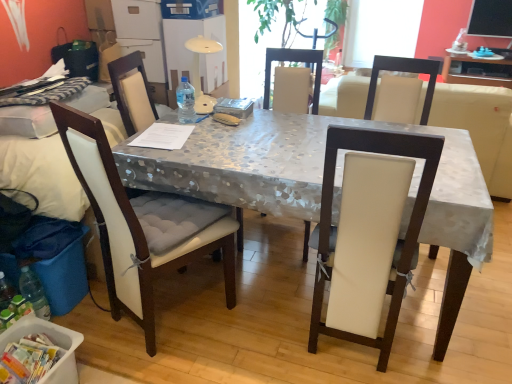
The width and height of the screenshot is (512, 384). What are the coordinates of `vacant space to the right of white leather chair at center, the third chair viewed from the left` in the screenshot? It's located at (434, 339).